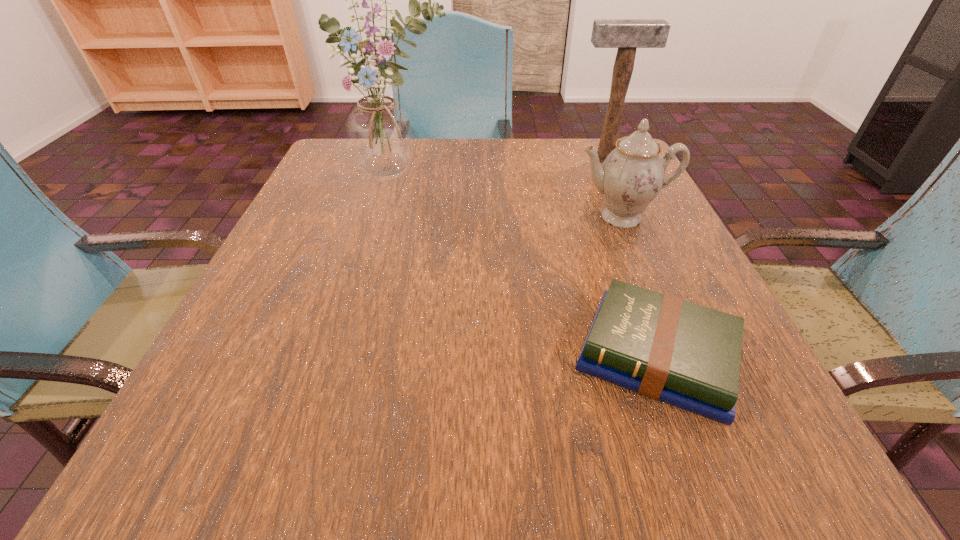
Where is `the leftmost object`? This screenshot has height=540, width=960. the leftmost object is located at coordinates (380, 134).

Find the location of a particular element. the tallest object is located at coordinates (380, 134).

Find the location of `the second tallest object`. the second tallest object is located at coordinates (627, 35).

Where is `chinaware`? This screenshot has height=540, width=960. chinaware is located at coordinates (632, 175).

Identify the location of the third tallest object. Image resolution: width=960 pixels, height=540 pixels. (632, 175).

Locate an element on the screen. Image resolution: width=960 pixels, height=540 pixels. book is located at coordinates (687, 355).

At what (x,y) coordinates should I click in order to perform the action: click on the nearest object. Please return your answer as a coordinate pair (x, y). The height and width of the screenshot is (540, 960). Looking at the image, I should click on (687, 355).

This screenshot has height=540, width=960. Find the location of `vacant position located on the front-facing side of the leftmost object`. vacant position located on the front-facing side of the leftmost object is located at coordinates (372, 267).

Identify the location of free spot located 0.050m on the left of the mallet. The height and width of the screenshot is (540, 960). (554, 159).

This screenshot has height=540, width=960. In order to click on vacant position located 0.360m on the spout of the second nearest object in this screenshot , I will do `click(698, 403)`.